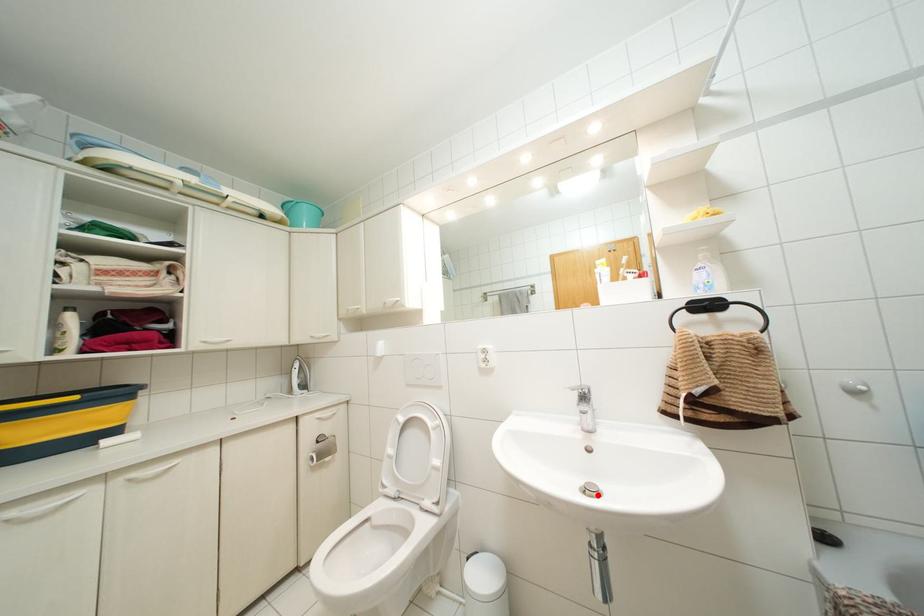
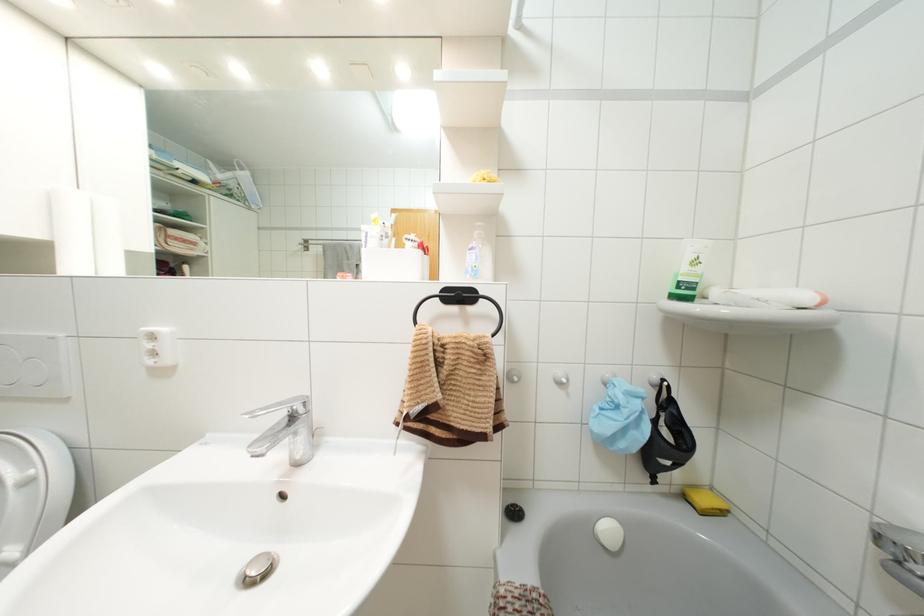
In the second image, find the point that corresponds to the highlighted location in the first image.

(265, 573)